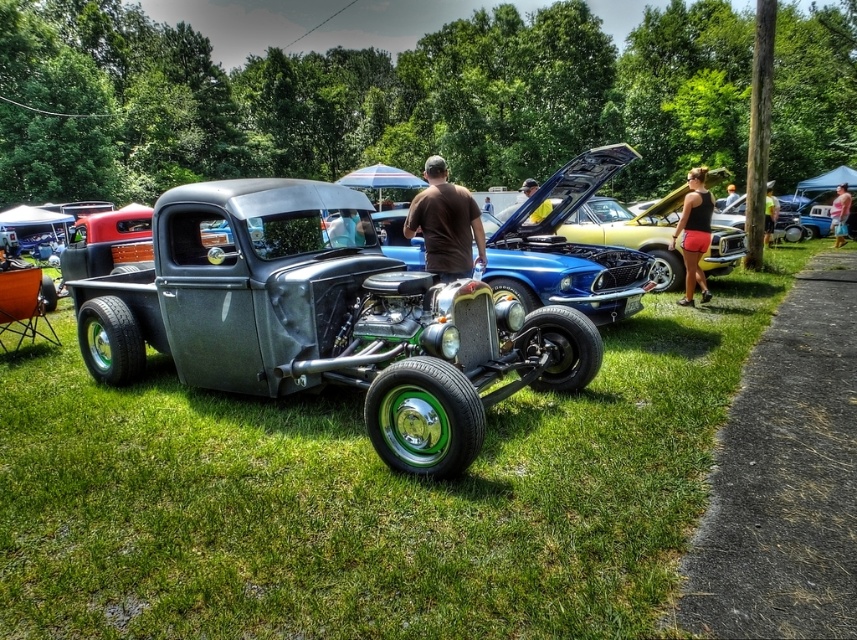
You are at a car show and see two shirts displayed at the center of the image. The shirts are labeled as brown cotton shirt at center and matte black shirt at center. Which shirt is smaller in size?

The brown cotton shirt at center is smaller in size compared to the matte black shirt at center.